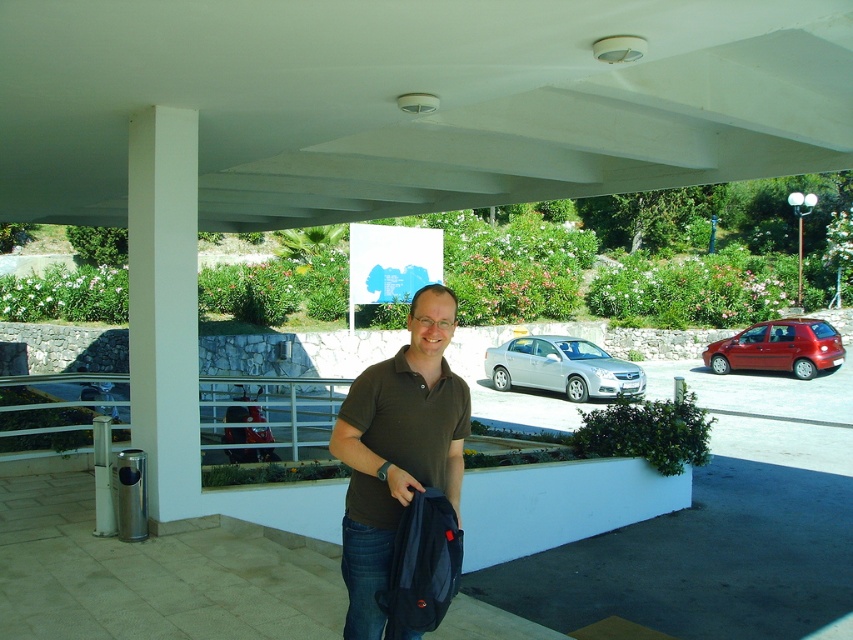
You are a photographer trying to capture a photo of the silver metallic sedan at center and the shiny red car at right. Since you want to include both cars in the frame, which car should you focus on first to ensure both are in the shot?

The silver metallic sedan at center is not as tall as the shiny red car at right, so you should focus on the shiny red car at right first to ensure both cars are in the frame.

In the scene shown: You are driving a car and need to park in the parking lot shown in the image. There is a silver metallic sedan at center and a shiny red car at right. Can you safely park your car between them without overlapping either vehicle?

The silver metallic sedan at center is positioned under shiny red car at right, so there is no space between them for your car to park safely without overlapping.

Based on the photo, you are standing at the carport and want to walk to the point that is behind the man. Which coordinate point should you head towards, point (532, 358) or point (718, 340)?

You should head towards point (718, 340) because it is behind the man, as point (532, 358) is in front of point (718, 340).